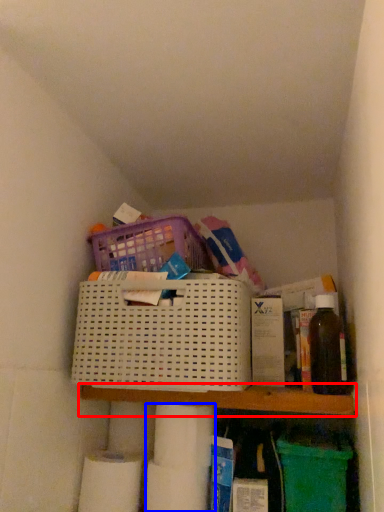
Question: Which object appears farthest to the camera in this image, shelf (highlighted by a red box) or toilet paper (highlighted by a blue box)?

Choices:
 (A) shelf
 (B) toilet paper

Answer: (B)